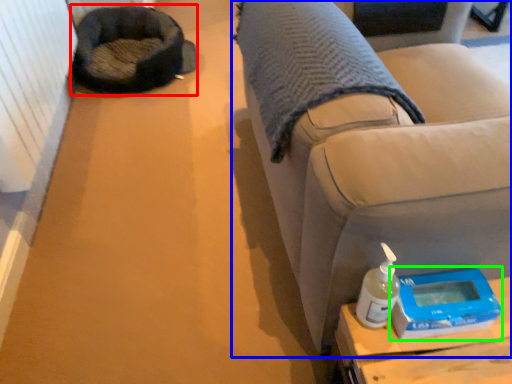
Question: Which object is the closest to the bean bag chair (highlighted by a red box)? Choose among these: furniture (highlighted by a blue box) or scale (highlighted by a green box).

Choices:
 (A) furniture
 (B) scale

Answer: (A)